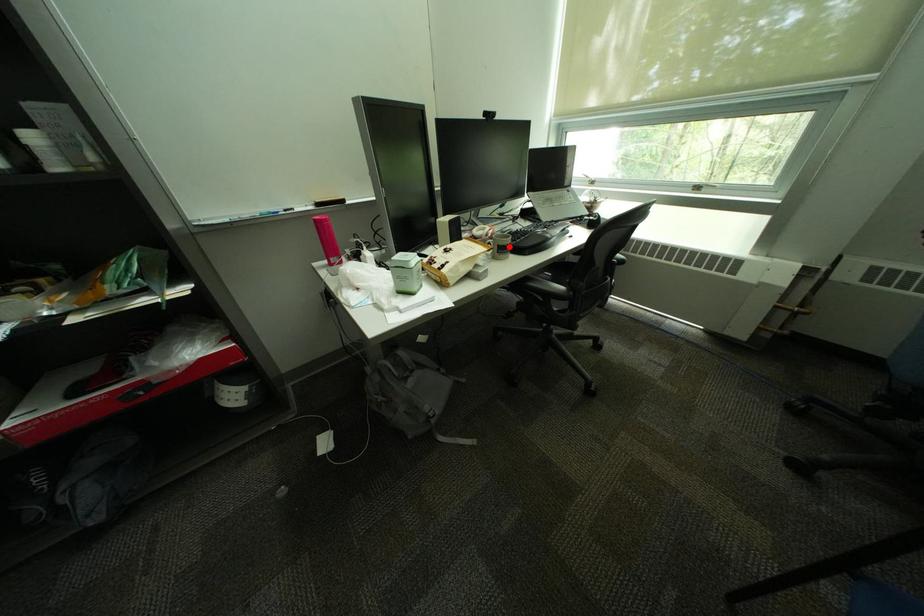
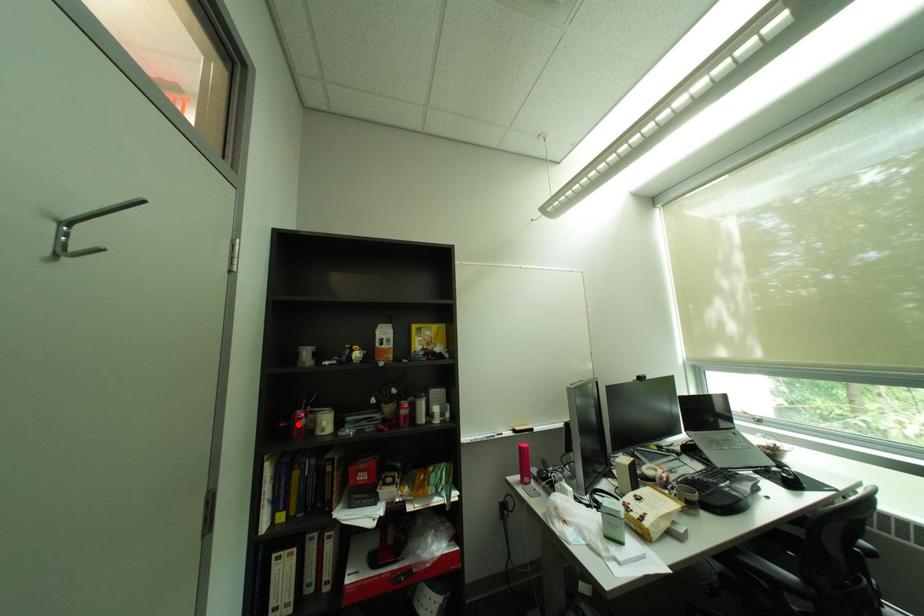
I am providing you with two images of the same scene from different viewpoints. A red point is marked on the first image and another point is marked on the second image. Is the red point in image1 aligned with the point shown in image2?

No